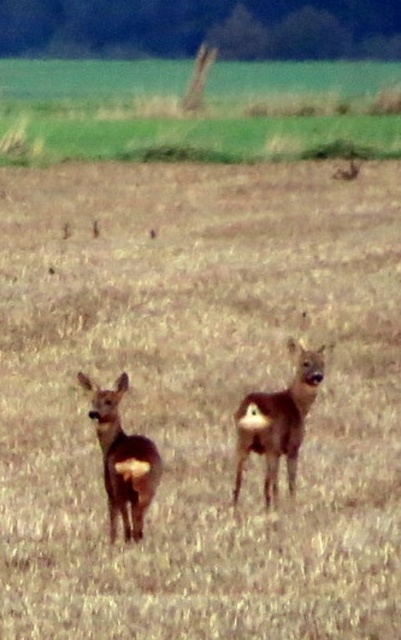
You are a wildlife photographer aiming to capture both the brown matte deer at center and the brown matte roe deer at center in a single shot. Based on their positions, which deer should you focus on to ensure both are in clear view?

The brown matte roe deer at center is behind the brown matte deer at center, so focusing on the brown matte deer at center will keep both in focus as the roe deer is behind it.

You are a wildlife photographer trying to capture both the brown matte deer at center and the brown matte roe deer at center in a single frame. Since you want to emphasize their size difference, which deer should you position closer to the camera to make them appear the same size?

To make the brown matte deer at center and the brown matte roe deer at center appear the same size in the photo, you should position the smaller brown matte roe deer at center closer to the camera since it is naturally smaller than the larger brown matte deer at center.